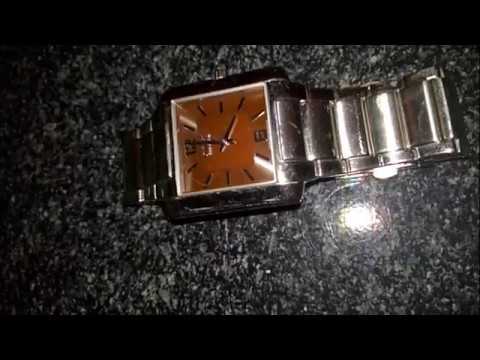
This screenshot has width=480, height=360. What are the coordinates of `tabletop` in the screenshot? It's located at (386, 253).